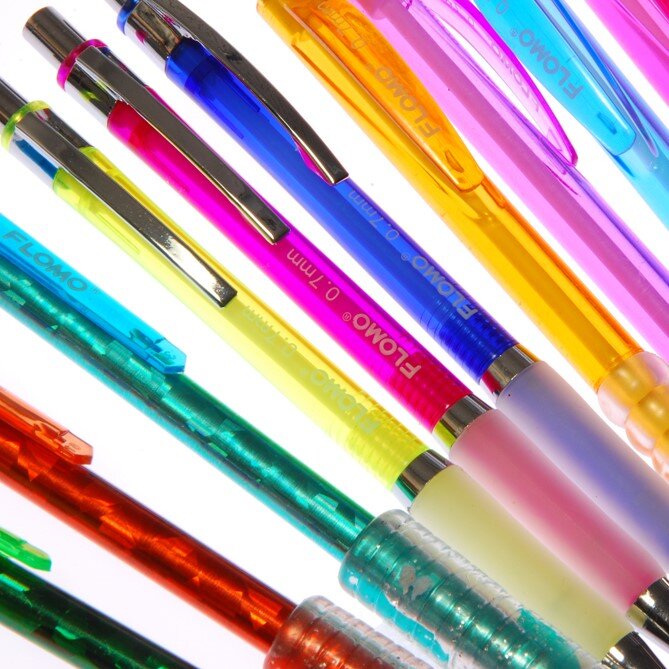
Identify the location of pens. (43, 615), (151, 561), (244, 466), (326, 389), (389, 351), (448, 312), (527, 246), (575, 213), (613, 136), (642, 43).